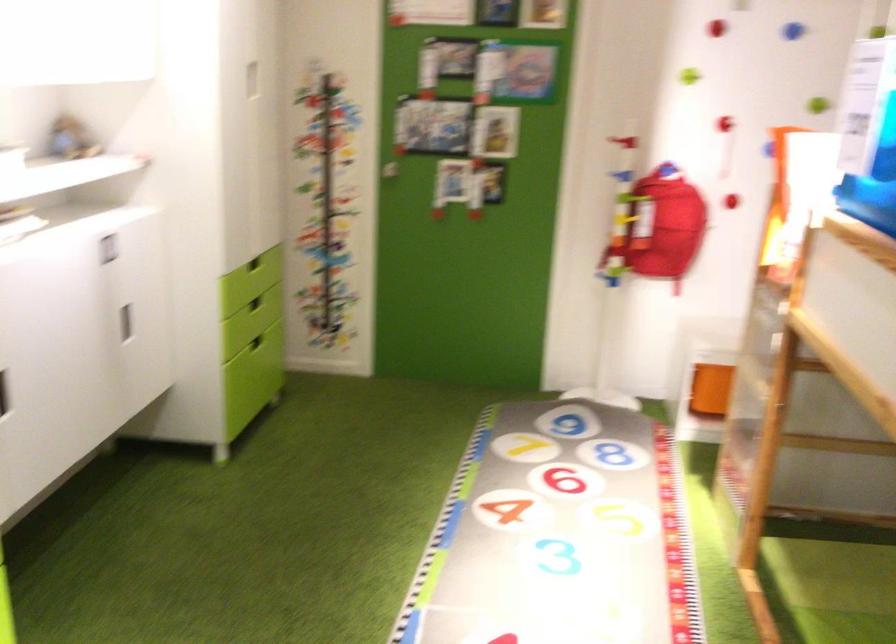
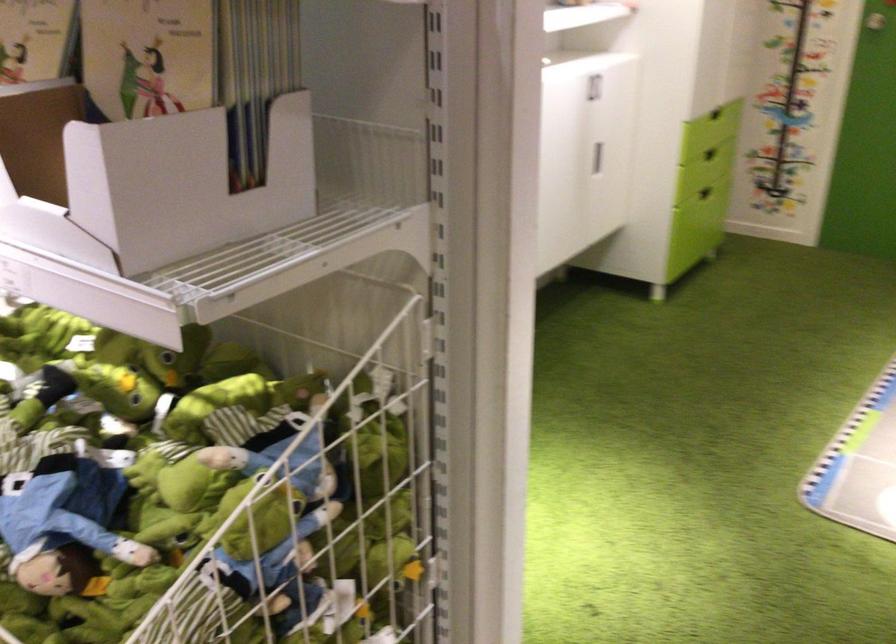
Locate, in the second image, the point that corresponds to [123,251] in the first image.

(593, 87)